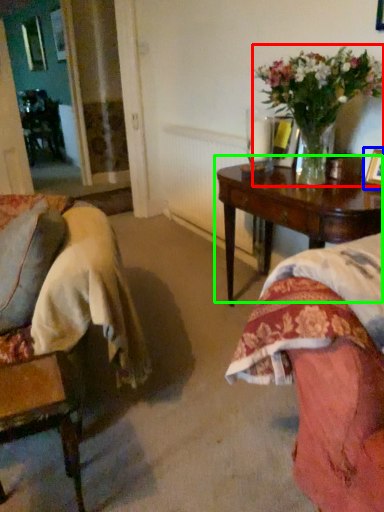
Question: Estimate the real-world distances between objects in this image. Which object is farther from houseplant (highlighted by a red box), picture frame (highlighted by a blue box) or table (highlighted by a green box)?

Choices:
 (A) picture frame
 (B) table

Answer: (A)